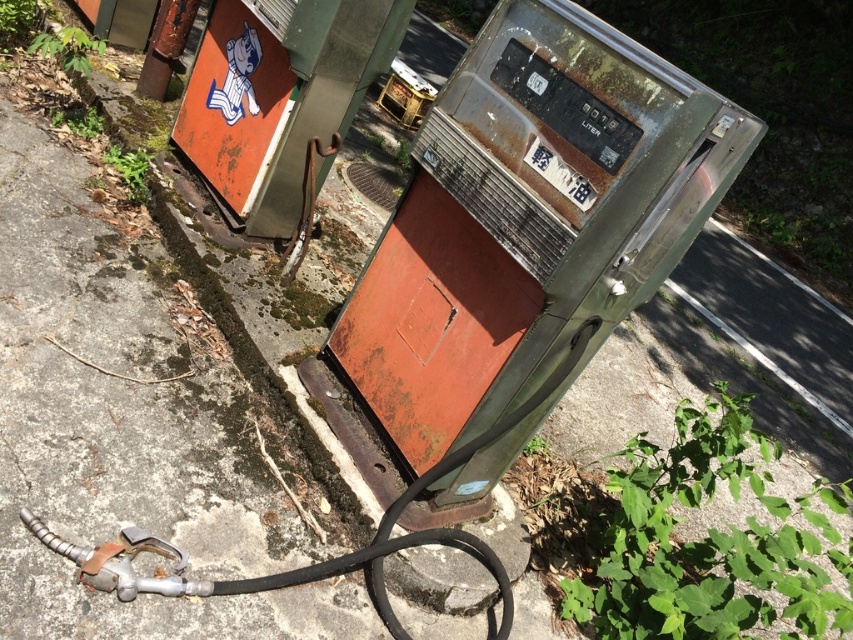
Describe the element at coordinates (67, 48) in the screenshot. I see `green leafy plant at upper left` at that location.

Is point (54, 36) less distant than point (120, 163)?

No.

Which is in front, point (50, 48) or point (107, 161)?

Point (107, 161) is more forward.

Identify the location of green leafy plant at upper left. The image size is (853, 640). (67, 48).

Consider the image. Does green leafy plant at lower right have a lesser width compared to green leafy plant at upper left?

In fact, green leafy plant at lower right might be wider than green leafy plant at upper left.

Which is behind, point (693, 440) or point (84, 65)?

Point (84, 65)

Which is in front, point (807, 577) or point (68, 52)?

Point (807, 577)

What are the coordinates of `green leafy plant at lower right` in the screenshot? It's located at (709, 541).

Between green leafy plant at lower right and green leafy weed at upper left, which one has more height?

Standing taller between the two is green leafy plant at lower right.

Who is more distant from viewer, (654, 552) or (142, 198)?

The point (142, 198) is more distant.

The image size is (853, 640). Find the location of `green leafy plant at lower right`. green leafy plant at lower right is located at coordinates coord(709,541).

Identify the location of green leafy plant at lower right. The width and height of the screenshot is (853, 640). (709, 541).